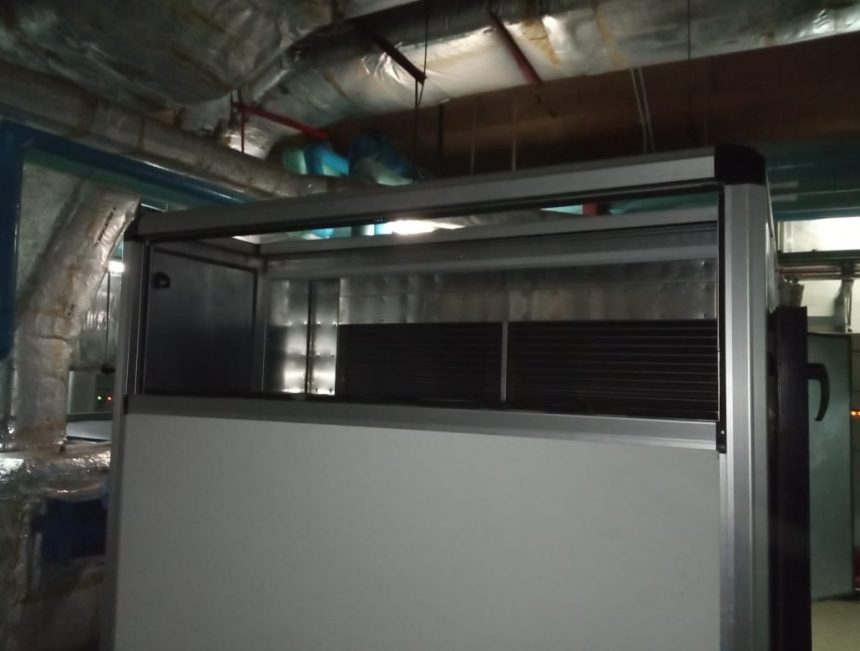
Where is `blue part of wall`? The width and height of the screenshot is (860, 651). blue part of wall is located at coordinates (7, 154).